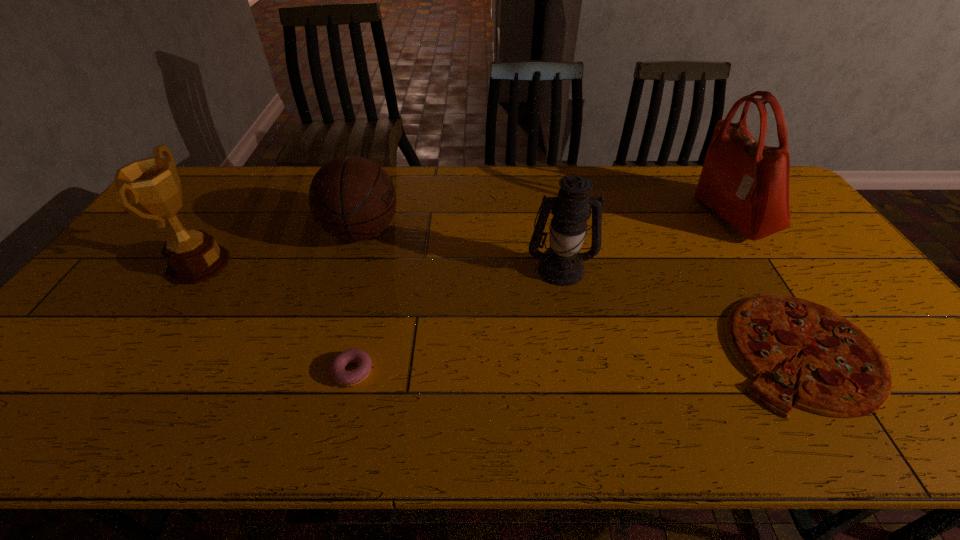
Where is `object situated at the near right corner`? This screenshot has height=540, width=960. object situated at the near right corner is located at coordinates (843, 374).

The width and height of the screenshot is (960, 540). In the image, there is a desktop. Find the location of `vacant space at the far edge`. vacant space at the far edge is located at coordinates (431, 200).

The height and width of the screenshot is (540, 960). Identify the location of vacant space at the near edge of the desktop. (705, 413).

The height and width of the screenshot is (540, 960). I want to click on free space at the left edge of the desktop, so tap(82, 364).

The width and height of the screenshot is (960, 540). In order to click on free location at the right edge of the desktop in this screenshot , I will do `click(832, 276)`.

At what (x,y) coordinates should I click in order to perform the action: click on vacant region at the far left corner of the desktop. Please return your answer as a coordinate pair (x, y). The image size is (960, 540). Looking at the image, I should click on (228, 179).

This screenshot has width=960, height=540. I want to click on vacant point located between the doughnut and the basketball, so click(357, 301).

You are a GUI agent. You are given a task and a screenshot of the screen. Output one action in this format:
    pyautogui.click(x=<x>, y=<y>)
    Task: Click on the free space between the fourth object from left to right and the handbag
    Image resolution: width=960 pixels, height=540 pixels.
    Given the screenshot: What is the action you would take?
    pyautogui.click(x=645, y=242)

At what (x,y) coordinates should I click in order to perform the action: click on empty space between the basketball and the award. Please return your answer as a coordinate pair (x, y). Image resolution: width=960 pixels, height=540 pixels. Looking at the image, I should click on (280, 248).

Identify the location of vacant space in between the pizza and the oil lamp. The width and height of the screenshot is (960, 540). (681, 309).